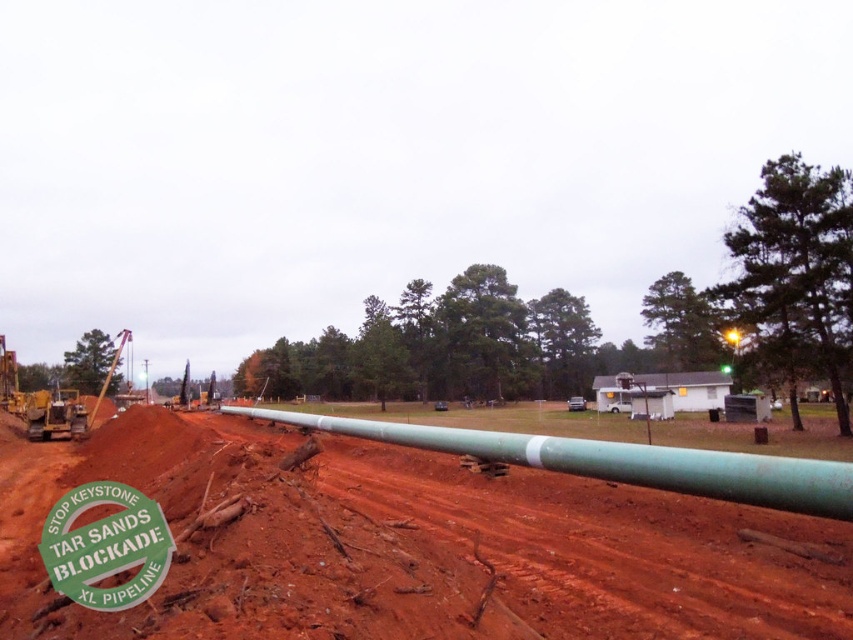
You are a construction worker standing at the camera position. You need to place a 12 feet long safety barrier between yourself and the red clay dirt at center. Is the distance sufficient?

The red clay dirt at center is 10.87 feet away from the camera. Since the safety barrier is 12 feet long, the distance is insufficient as it is shorter than the required length.

You are a construction worker who needs to place a 3.5 meter long safety barrier between the red clay dirt at center and the pipeline. Is there enough space to place it without overlapping either object?

The distance between the red clay dirt at center and the pipeline is 3.31 meters. Since the safety barrier is 3.5 meters long, it is slightly longer than the available space. Therefore, the barrier cannot be placed without overlapping one of the objects.

You are a safety inspector checking the construction site. You notice the green matte pipe at center and the green paper sign at lower left. Which object is wider in terms of physical dimensions?

The green matte pipe at center might be wider than green paper sign at lower left according to the description provided.